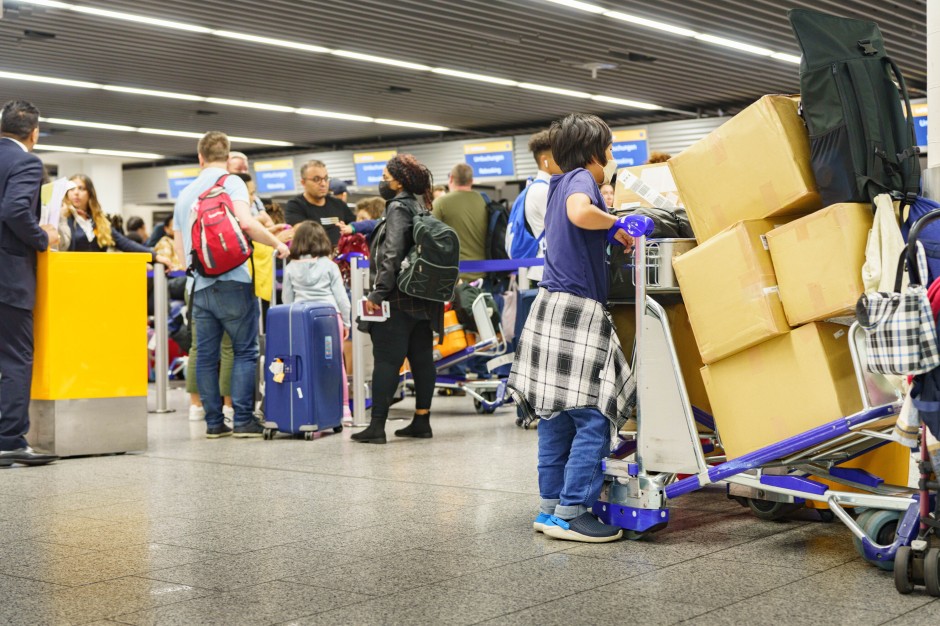
At what (x,y) coordinates should I click in order to perform the action: click on boxes. Please return your answer as a coordinate pair (x, y). This screenshot has height=626, width=940. Looking at the image, I should click on (766, 171), (733, 280), (820, 270), (776, 370), (650, 178).